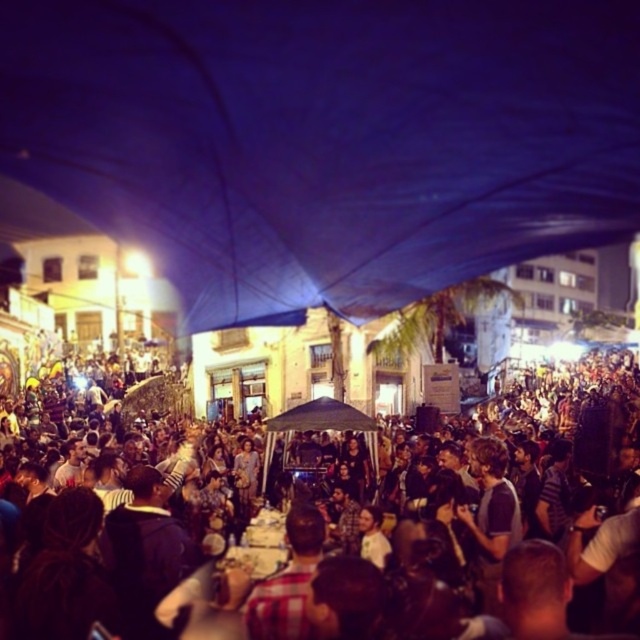
Question: Which point appears farthest from the camera in this image?

Choices:
 (A) (504, 109)
 (B) (568, 397)

Answer: (B)

Question: Can you confirm if blue fabric canopy at upper center is positioned to the right of multicolored fabric crowd at center?

Choices:
 (A) no
 (B) yes

Answer: (A)

Question: Is blue fabric canopy at upper center positioned at the back of multicolored fabric crowd at center?

Choices:
 (A) no
 (B) yes

Answer: (B)

Question: Does blue fabric canopy at upper center have a smaller size compared to multicolored fabric crowd at center?

Choices:
 (A) yes
 (B) no

Answer: (A)